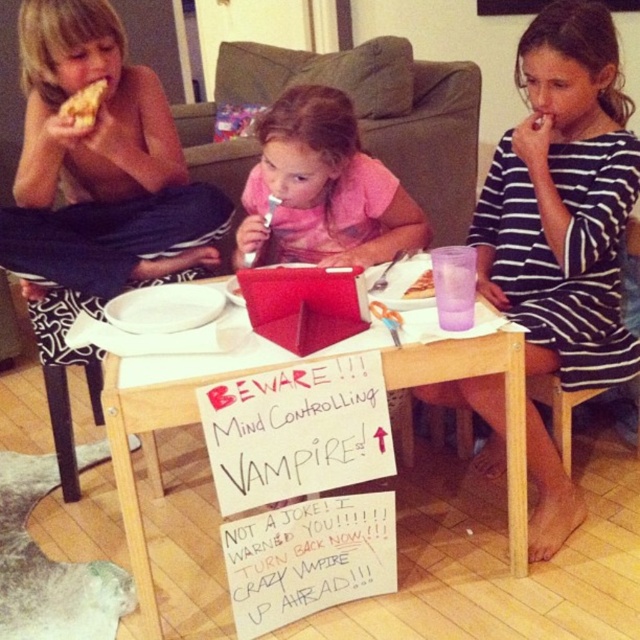
You are a parent trying to ensure your child doesn not trip on the matte black shorts at left while reaching for the golden crispy pizza slice at upper left. Given their sizes, which item is more likely to cause a tripping hazard?

The matte black shorts at left is bigger than the golden crispy pizza slice at upper left, making it more likely to cause a tripping hazard.

Based on the photo, you are a robot with a 15 cm wide arm. You need to pick up the golden crispy pizza slice at upper left while avoiding touching the matte black shorts at left. Can your arm fit between them?

The distance between the matte black shorts at left and golden crispy pizza slice at upper left is 16.51 centimeters, so yes, the robot can fit its 15 cm wide arm between them without touching either object.

You are a parent trying to locate your child who is wearing a striped fabric dress at center and matte black shorts at left. Based on the scene description, where would you find the child in relation to the other children?

The striped fabric dress at center is positioned on the right side of matte black shorts at left, so the child wearing the striped fabric dress at center is sitting to the right of the child in matte black shorts at left. Since both are at the table, the parent can find them seated next to each other at the small wooden table.